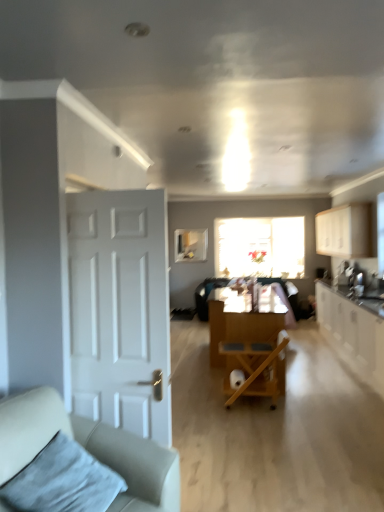
Question: From a real-world perspective, is white matte cabinet at upper right, which is the second cabinetry from bottom to top, above or below white matte door at left?

Choices:
 (A) below
 (B) above

Answer: (B)

Question: Based on their sizes in the image, would you say white matte cabinet at upper right, which is the second cabinetry from bottom to top, is bigger or smaller than white matte door at left?

Choices:
 (A) big
 (B) small

Answer: (A)

Question: Which object is the farthest from the wooden cart at center?

Choices:
 (A) beige fabric couch at left
 (B) white matte door at left
 (C) velvety gray pillow at lower left
 (D) white glossy cabinets at right, placed as the second cabinetry when sorted from top to bottom
 (E) clear glass window screen at upper center

Answer: (E)

Question: Which object is positioned closest to the wooden cart at center?

Choices:
 (A) translucent glass window at center
 (B) white glossy cabinets at right, which is counted as the 1th cabinetry, starting from the bottom
 (C) wooden folding chair at center
 (D) white matte cabinet at upper right, which is the second cabinetry from bottom to top
 (E) beige fabric couch at left

Answer: (C)